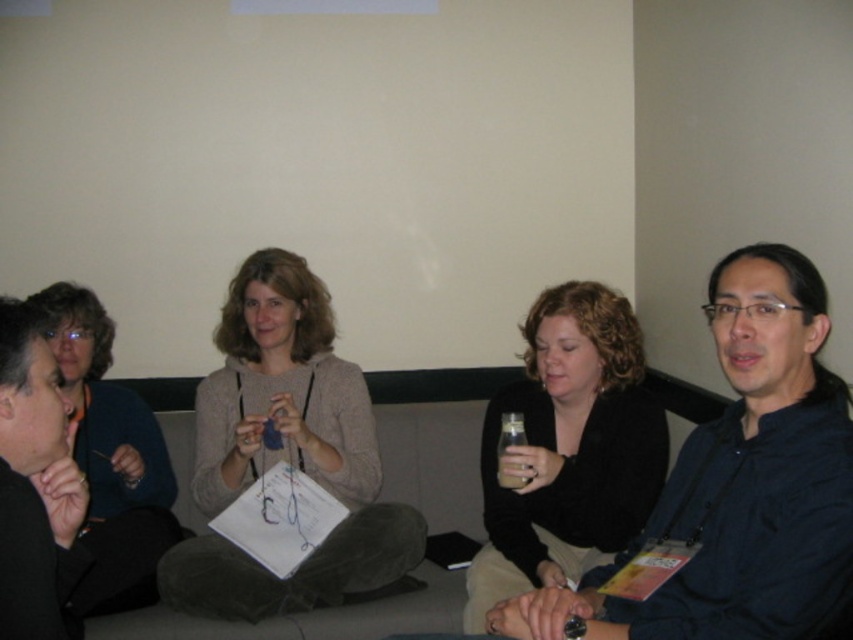
Question: Which point appears farthest from the camera in this image?

Choices:
 (A) tap(503, 417)
 (B) tap(172, 540)
 (C) tap(38, 502)

Answer: (B)

Question: Considering the relative positions of matte black sweater at center and matte blue sweater at left in the image provided, where is matte black sweater at center located with respect to matte blue sweater at left?

Choices:
 (A) left
 (B) right

Answer: (B)

Question: Can you confirm if matte black sweater at center is bigger than matte blue sweater at left?

Choices:
 (A) yes
 (B) no

Answer: (B)

Question: Estimate the real-world distances between objects in this image. Which object is closer to the brown matte bottle at center?

Choices:
 (A) matte black sweater at center
 (B) black matte jacket at left

Answer: (A)

Question: Can you confirm if matte black sweater at center is wider than black matte jacket at left?

Choices:
 (A) no
 (B) yes

Answer: (B)

Question: Based on their relative distances, which object is nearer to the black matte jacket at left?

Choices:
 (A) matte blue sweater at left
 (B) brown matte bottle at center
 (C) knitted beige sweater at center
 (D) matte black shirt at center

Answer: (A)